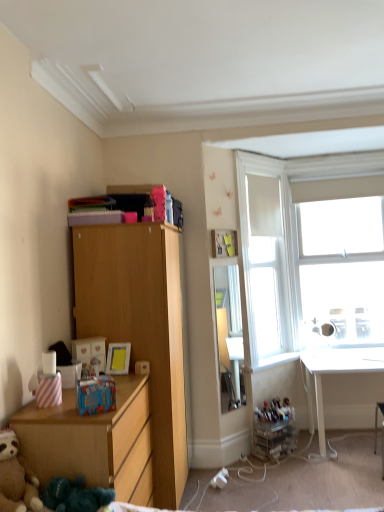
Question: Is white glossy window sill at lower right aimed at brown plush teddy bear at lower left?

Choices:
 (A) yes
 (B) no

Answer: (B)

Question: Considering the relative sizes of white glossy window sill at lower right and brown plush teddy bear at lower left in the image provided, is white glossy window sill at lower right wider than brown plush teddy bear at lower left?

Choices:
 (A) yes
 (B) no

Answer: (B)

Question: Considering the relative sizes of white glossy window sill at lower right and brown plush teddy bear at lower left in the image provided, is white glossy window sill at lower right bigger than brown plush teddy bear at lower left?

Choices:
 (A) no
 (B) yes

Answer: (A)

Question: From a real-world perspective, is white glossy window sill at lower right under brown plush teddy bear at lower left?

Choices:
 (A) yes
 (B) no

Answer: (A)

Question: Can you confirm if white glossy window sill at lower right is thinner than brown plush teddy bear at lower left?

Choices:
 (A) yes
 (B) no

Answer: (A)

Question: In terms of width, does white glossy desk at lower right look wider or thinner when compared to wooden chest of drawers at lower left?

Choices:
 (A) thin
 (B) wide

Answer: (B)

Question: In terms of height, does white glossy desk at lower right look taller or shorter compared to wooden chest of drawers at lower left?

Choices:
 (A) tall
 (B) short

Answer: (B)

Question: Considering the positions of white glossy desk at lower right and wooden chest of drawers at lower left in the image, is white glossy desk at lower right bigger or smaller than wooden chest of drawers at lower left?

Choices:
 (A) small
 (B) big

Answer: (A)

Question: From the image's perspective, is white glossy desk at lower right above or below wooden chest of drawers at lower left?

Choices:
 (A) above
 (B) below

Answer: (B)

Question: Is point (39, 478) closer or farther from the camera than point (288, 310)?

Choices:
 (A) closer
 (B) farther

Answer: (A)

Question: Considering the relative positions of wooden chest of drawers at lower left and white fabric at upper right in the image provided, is wooden chest of drawers at lower left to the left or to the right of white fabric at upper right?

Choices:
 (A) right
 (B) left

Answer: (B)

Question: Is wooden chest of drawers at lower left inside or outside of white fabric at upper right?

Choices:
 (A) inside
 (B) outside

Answer: (B)

Question: Looking at the image, does wooden chest of drawers at lower left seem bigger or smaller compared to white fabric at upper right?

Choices:
 (A) big
 (B) small

Answer: (A)

Question: Is white glossy window sill at lower right in front of or behind light wood cabinet at left in the image?

Choices:
 (A) behind
 (B) front

Answer: (A)

Question: Which is correct: white glossy window sill at lower right is inside light wood cabinet at left, or outside of it?

Choices:
 (A) outside
 (B) inside

Answer: (A)